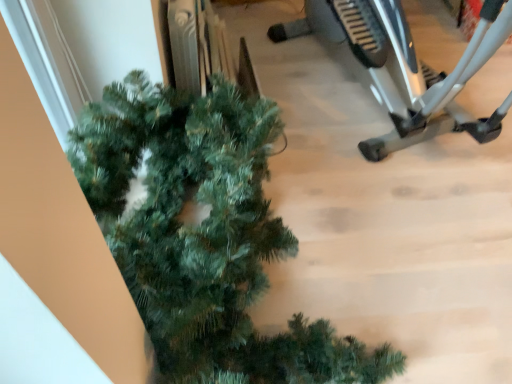
Where is `vacant space in front of silver metallic stationary bicycle at right`? vacant space in front of silver metallic stationary bicycle at right is located at coordinates (411, 228).